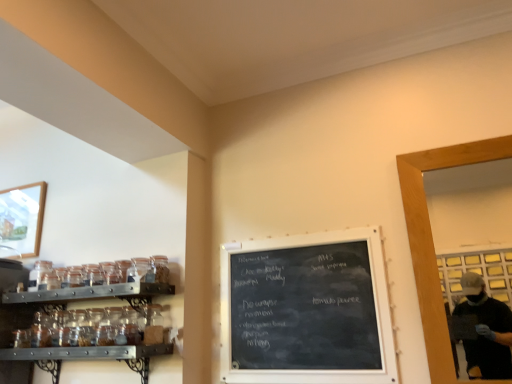
Question: Is wooden framed picture at upper left shorter than clear glass jar at left, the second glass jar when ordered from right to left?

Choices:
 (A) yes
 (B) no

Answer: (B)

Question: Is clear glass jar at left, the first glass jar when ordered from back to front, at the back of wooden framed picture at upper left?

Choices:
 (A) yes
 (B) no

Answer: (B)

Question: Does wooden framed picture at upper left have a greater height compared to clear glass jar at left, the second glass jar when ordered from right to left?

Choices:
 (A) yes
 (B) no

Answer: (A)

Question: Does wooden framed picture at upper left appear on the right side of clear glass jar at left, the second glass jar when ordered from right to left?

Choices:
 (A) no
 (B) yes

Answer: (A)

Question: Is wooden framed picture at upper left far away from clear glass jar at left, the first glass jar when ordered from back to front?

Choices:
 (A) yes
 (B) no

Answer: (B)

Question: Considering the positions of point (281, 284) and point (155, 274), is point (281, 284) closer or farther from the camera than point (155, 274)?

Choices:
 (A) closer
 (B) farther

Answer: (B)

Question: From the image's perspective, is black chalkboard at center above or below transparent glass jar at upper left, the second glass jar when ordered from back to front?

Choices:
 (A) below
 (B) above

Answer: (A)

Question: Visually, is black chalkboard at center positioned to the left or to the right of transparent glass jar at upper left, positioned as the 1th glass jar in right-to-left order?

Choices:
 (A) left
 (B) right

Answer: (B)

Question: Considering the positions of black chalkboard at center and transparent glass jar at upper left, acting as the 2th glass jar starting from the left, in the image, is black chalkboard at center taller or shorter than transparent glass jar at upper left, acting as the 2th glass jar starting from the left,?

Choices:
 (A) short
 (B) tall

Answer: (B)

Question: Based on their positions, is black chalkboard at center located to the left or right of wooden framed picture at upper left?

Choices:
 (A) right
 (B) left

Answer: (A)

Question: Is point (366, 374) positioned closer to the camera than point (28, 215)?

Choices:
 (A) farther
 (B) closer

Answer: (B)

Question: Is black chalkboard at center in front of or behind wooden framed picture at upper left in the image?

Choices:
 (A) behind
 (B) front

Answer: (B)

Question: Considering the positions of black chalkboard at center and wooden framed picture at upper left in the image, is black chalkboard at center taller or shorter than wooden framed picture at upper left?

Choices:
 (A) tall
 (B) short

Answer: (A)

Question: In terms of height, does wooden framed picture at upper left look taller or shorter compared to wooden frame at right?

Choices:
 (A) short
 (B) tall

Answer: (A)

Question: Is wooden framed picture at upper left to the left or to the right of wooden frame at right in the image?

Choices:
 (A) right
 (B) left

Answer: (B)